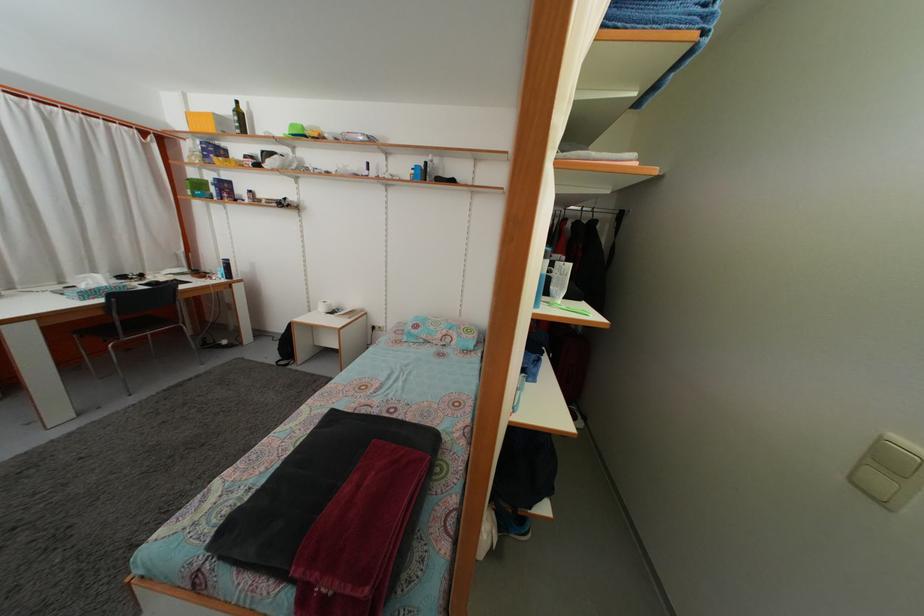
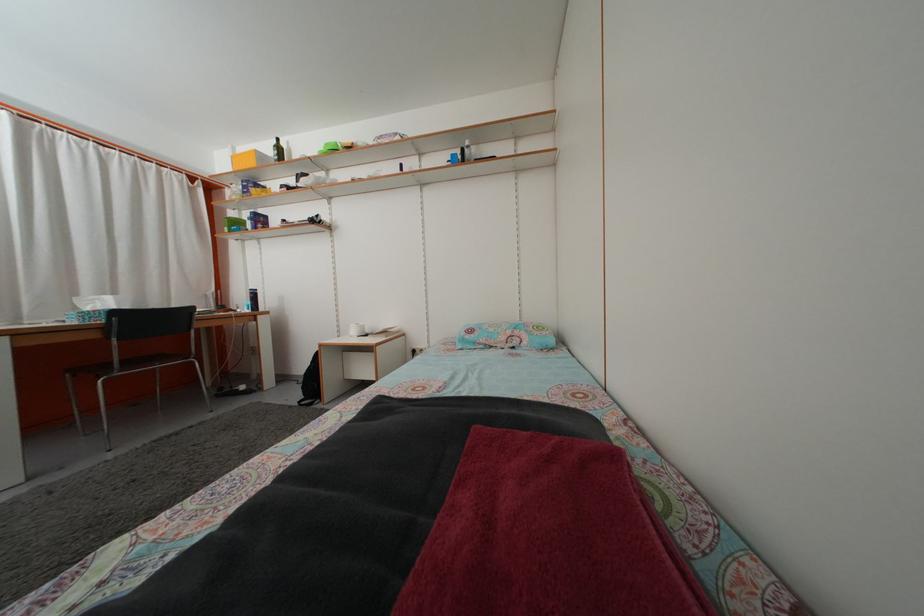
Locate, in the second image, the point that corresponds to (x=90, y=294) in the first image.

(94, 317)